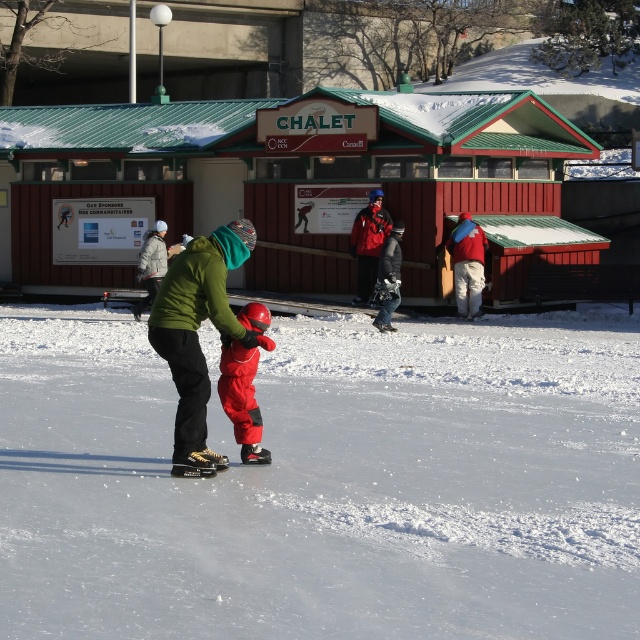
Question: Is white smooth ice at center positioned at the back of red matte jacket at center?

Choices:
 (A) yes
 (B) no

Answer: (B)

Question: Which point is farther to the camera?

Choices:
 (A) (378, 216)
 (B) (202, 420)
 (C) (465, 275)

Answer: (A)

Question: Is white smooth ice at center positioned behind green fleece jacket at center?

Choices:
 (A) yes
 (B) no

Answer: (B)

Question: Can you confirm if green fleece jacket at center is smaller than red matte jacket at center?

Choices:
 (A) no
 (B) yes

Answer: (B)

Question: Among these points, which one is nearest to the camera?

Choices:
 (A) (448, 428)
 (B) (464, 260)
 (C) (252, 396)

Answer: (C)

Question: Which point appears farthest from the camera in this image?

Choices:
 (A) (241, 236)
 (B) (472, 304)
 (C) (392, 278)

Answer: (B)